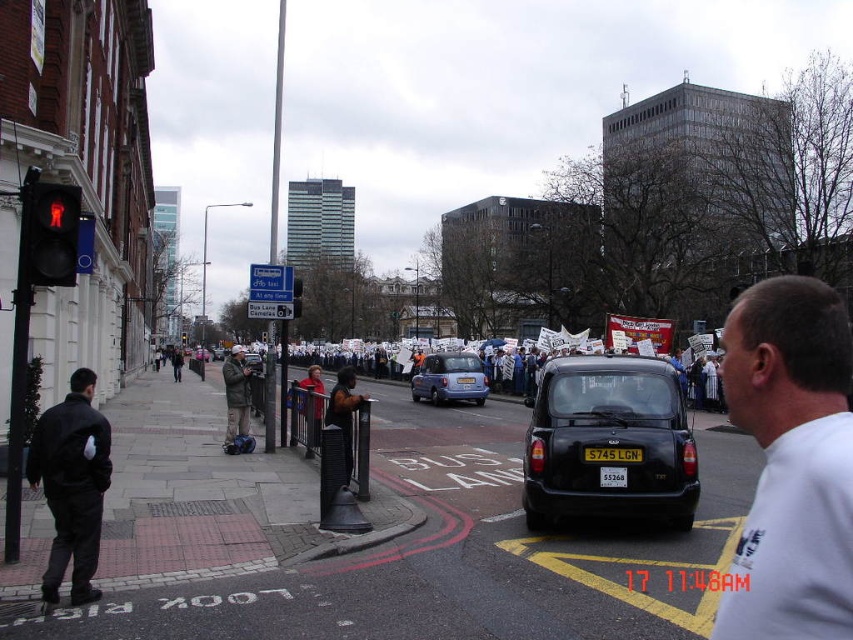
You are a pedestrian standing at the pedestrian crossing and see a person wearing a white shirt at center and a khaki cotton jacket at center. Which clothing item is larger?

The khaki cotton jacket at center is larger than the white shirt at center.

You are a pedestrian waiting to cross the street. You see a matte blue car at center and a yellow matte license plate at center. Which object is closer to the ground?

The matte blue car at center is located below the yellow matte license plate at center, so the matte blue car at center is closer to the ground.